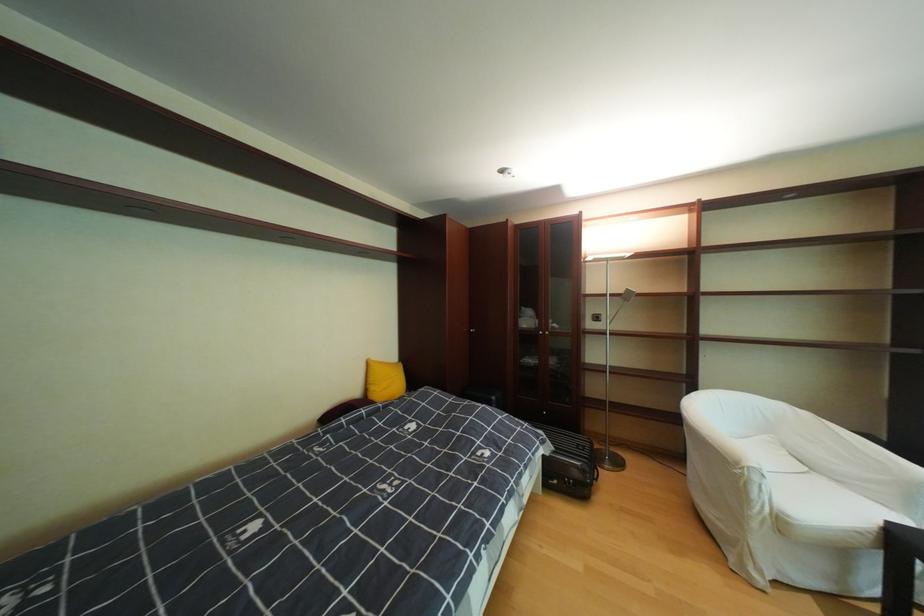
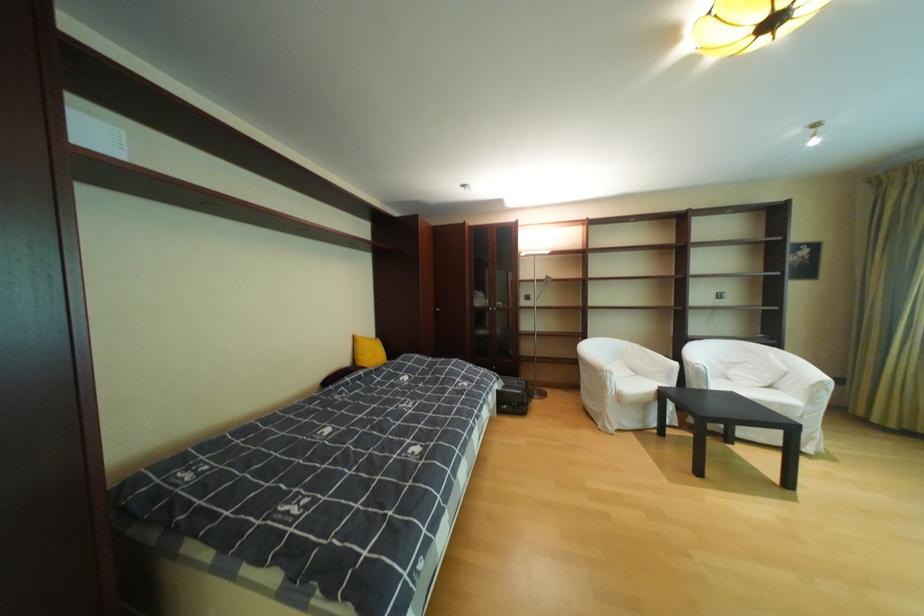
Where in the second image is the point corresponding to (x=580, y=483) from the first image?

(526, 405)